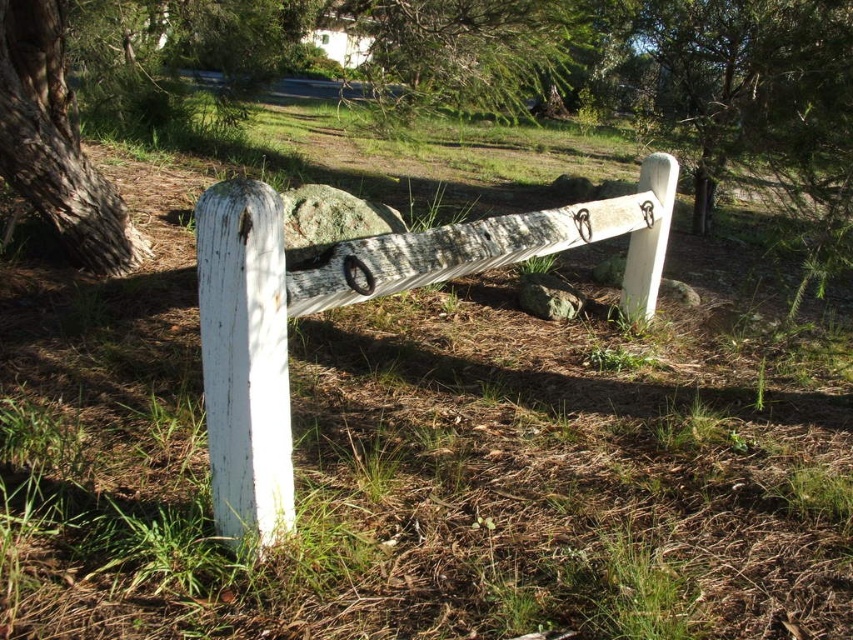
You are standing in front of the white weathered wood post at center and the green textured tree at upper center. Which object is taller?

The green textured tree at upper center is taller than the white weathered wood post at center.

You are standing in a natural setting and see a rustic wooden fence post and rail. There is a point at coordinates [459,83]. Is there an object at that point?

Yes, the white wood tree at center is located at point [459,83].